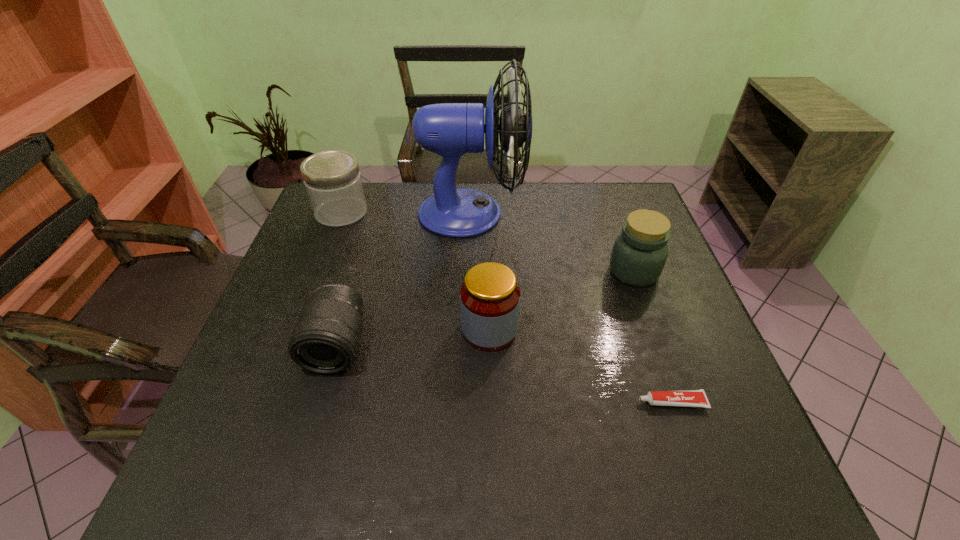
I want to click on jar at the right edge, so click(x=639, y=253).

Locate an element on the screen. This screenshot has width=960, height=540. toothpaste present at the right edge is located at coordinates (686, 398).

What are the coordinates of `object at the far left corner` in the screenshot? It's located at (332, 178).

Where is `vacant region at the far edge of the desktop`? vacant region at the far edge of the desktop is located at coordinates (517, 213).

Where is `free spot at the near edge of the desktop`? This screenshot has height=540, width=960. free spot at the near edge of the desktop is located at coordinates (474, 462).

This screenshot has width=960, height=540. In the image, there is a desktop. In order to click on free space at the left edge in this screenshot , I will do `click(287, 303)`.

Find the location of `vacant space at the right edge of the desktop`. vacant space at the right edge of the desktop is located at coordinates (673, 350).

This screenshot has height=540, width=960. I want to click on free space at the far right corner, so click(x=588, y=183).

Identify the location of vacant region between the tallest object and the fifth tallest object. (404, 279).

Locate an element on the screen. This screenshot has height=540, width=960. empty space that is in between the nearest jar and the telephoto lens is located at coordinates pyautogui.click(x=413, y=338).